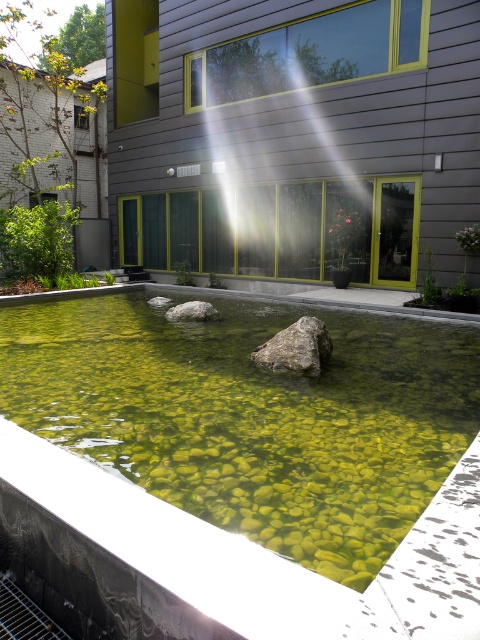
Is point (264, 362) positioned in front of point (168, 317)?

That is True.

Who is taller, gray/rough rock at center or gray rough stone at center?

With more height is gray/rough rock at center.

I want to click on gray/rough rock at center, so click(x=296, y=348).

Between point (312, 310) and point (313, 346), which one is positioned behind?

Point (312, 310)

Measure the distance between green pebbled pool at center and camera.

green pebbled pool at center and camera are 4.48 meters apart.

You are a GUI agent. You are given a task and a screenshot of the screen. Output one action in this format:
    pyautogui.click(x=<x>, y=<y>)
    Task: Click on the green pebbled pool at center
    
    Given the screenshot: What is the action you would take?
    pyautogui.click(x=252, y=417)

Which is below, green pebbled pool at center or gray rough stone at center?

green pebbled pool at center

Locate an element on the screen. green pebbled pool at center is located at coordinates (252, 417).